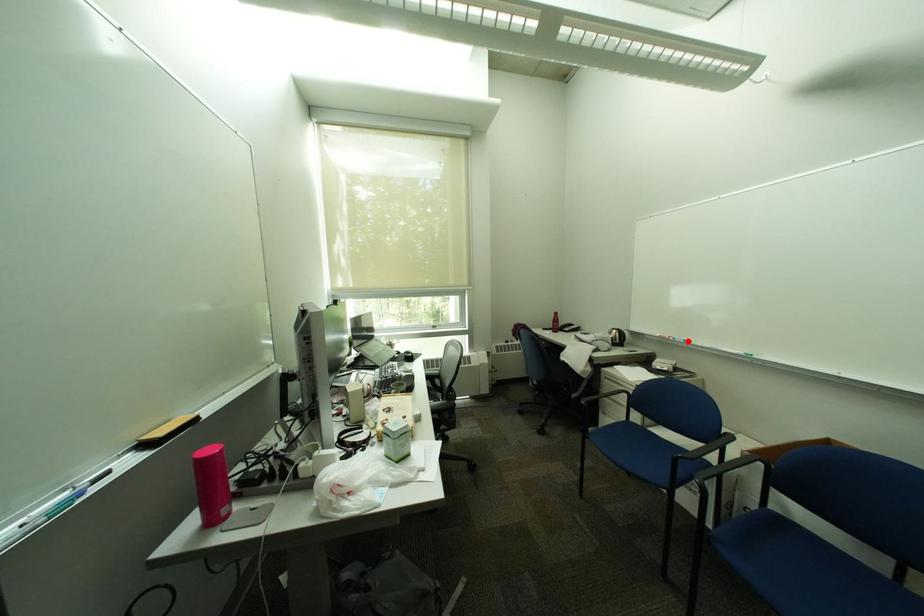
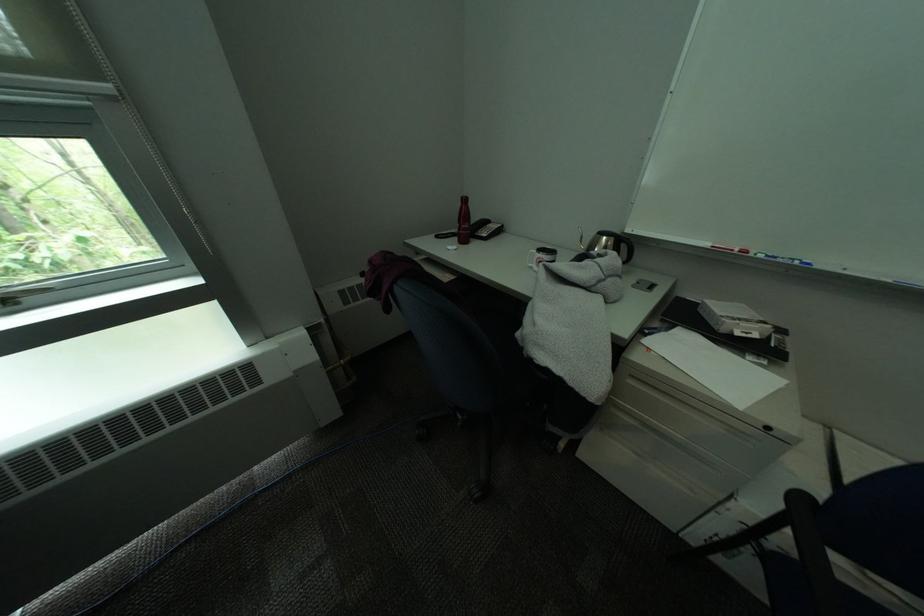
The point at the highlighted location is marked in the first image. Where is the corresponding point in the second image?

(791, 262)